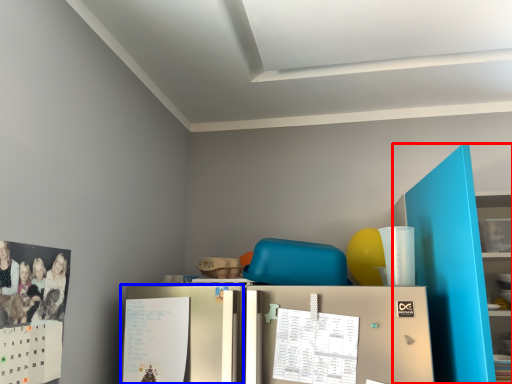
Question: Which object appears closest to the camera in this image, bookshelf (highlighted by a red box) or fridge (highlighted by a blue box)?

Choices:
 (A) bookshelf
 (B) fridge

Answer: (A)